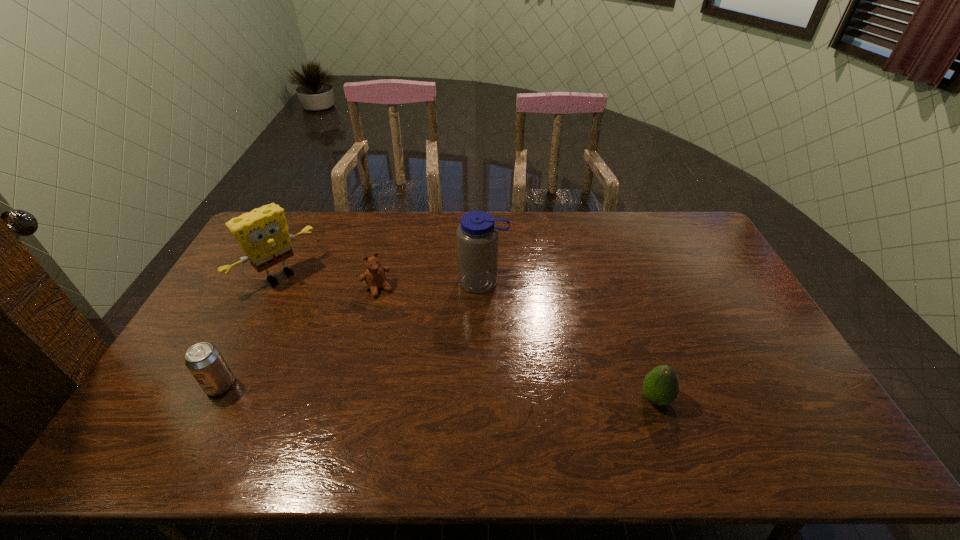
Locate an element on the screen. Image resolution: width=960 pixels, height=540 pixels. object present at the near left corner is located at coordinates (205, 362).

Locate an element on the screen. The width and height of the screenshot is (960, 540). vacant space at the far edge of the desktop is located at coordinates (442, 214).

The width and height of the screenshot is (960, 540). Find the location of `vacant region at the near edge of the desktop`. vacant region at the near edge of the desktop is located at coordinates (396, 414).

The width and height of the screenshot is (960, 540). Find the location of `free space at the left edge of the desktop`. free space at the left edge of the desktop is located at coordinates (252, 277).

This screenshot has height=540, width=960. I want to click on vacant space at the right edge of the desktop, so click(x=724, y=267).

This screenshot has width=960, height=540. What are the coordinates of `unoccupied area between the teddy bear and the avocado` in the screenshot? It's located at (516, 343).

I want to click on empty location between the rightmost object and the beer can, so click(x=438, y=392).

This screenshot has width=960, height=540. In order to click on vacant area that lies between the third object from left to right and the avocado in this screenshot , I will do `click(516, 343)`.

The height and width of the screenshot is (540, 960). Identify the location of free space that is in between the avocado and the beer can. (438, 392).

The image size is (960, 540). Identify the location of empty location between the third object from left to right and the avocado. (516, 343).